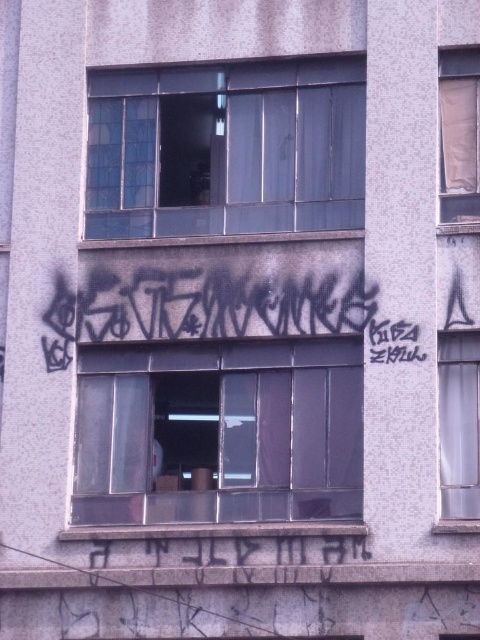
You are standing in front of the building and notice the transparent glass window at center and the black spray paint graffiti at center. Which object is nearer to you?

The transparent glass window at center is closer to the viewer than the black spray paint graffiti at center, so the transparent glass window at center is nearer.

You are an architect designing a new building and want to ensure that the clear glass window at upper center and the brown paper at upper right are proportionally balanced. Given the building facade described, can you determine which object is wider?

The clear glass window at upper center is wider than the brown paper at upper right, so to achieve proportional balance, the architect should consider adjusting the dimensions or placement of these elements accordingly.